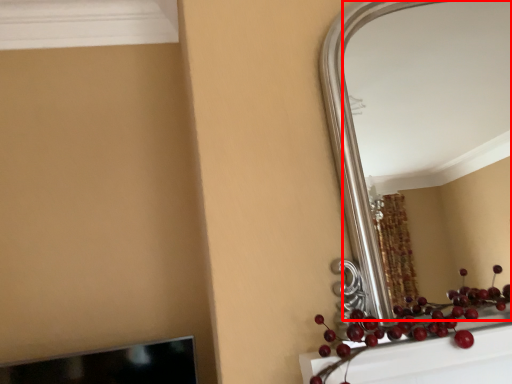
Question: In this image, where is mirror (annotated by the red box) located relative to fruit?

Choices:
 (A) left
 (B) right

Answer: (B)